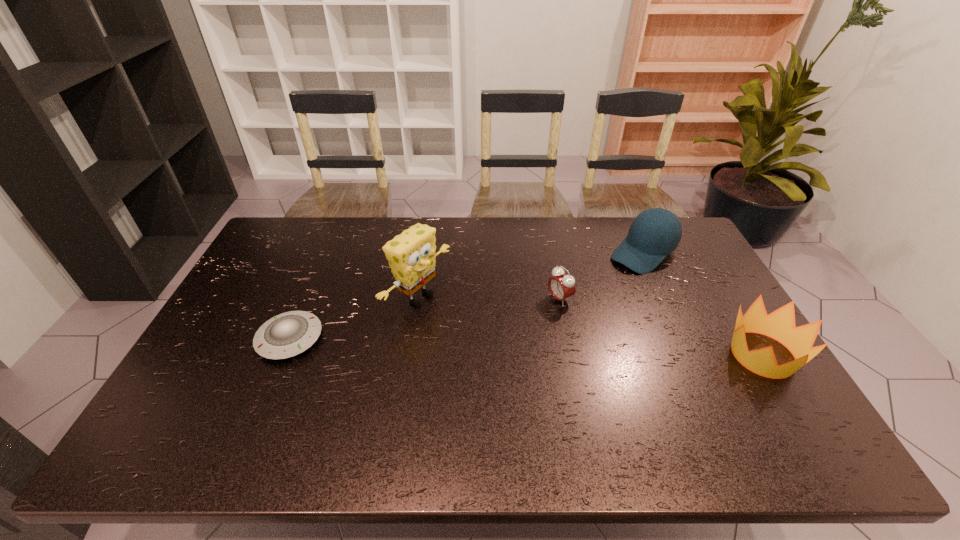
At what (x,y) coordinates should I click in order to perform the action: click on free region located on the clock face of the third object from left to right. Please return your answer as a coordinate pair (x, y). Looking at the image, I should click on (448, 356).

The image size is (960, 540). I want to click on vacant region located on the clock face of the third object from left to right, so click(527, 316).

At what (x,y) coordinates should I click in order to perform the action: click on blank area located on the face of the second object from left to right. Please return your answer as a coordinate pair (x, y). This screenshot has width=960, height=540. Looking at the image, I should click on (464, 327).

The image size is (960, 540). Find the location of `vacant space located on the face of the second object from left to right`. vacant space located on the face of the second object from left to right is located at coordinates (545, 372).

In order to click on blank area located on the face of the second object from left to right in this screenshot , I will do `click(500, 348)`.

You are a GUI agent. You are given a task and a screenshot of the screen. Output one action in this format:
    pyautogui.click(x=<x>, y=<y>)
    Task: Click on the vacant space located 0.110m on the front-facing side of the fourth shortest object
    Image resolution: width=960 pixels, height=540 pixels.
    Given the screenshot: What is the action you would take?
    pyautogui.click(x=604, y=282)

Locate an element on the screen. vacant position located on the front-facing side of the fourth shortest object is located at coordinates (553, 321).

Where is `free region located on the front-facing side of the fourth shortest object`? free region located on the front-facing side of the fourth shortest object is located at coordinates (588, 294).

Find the location of `object present at the far edge`. object present at the far edge is located at coordinates (656, 232).

Locate an element on the screen. The width and height of the screenshot is (960, 540). object that is at the near edge is located at coordinates (780, 325).